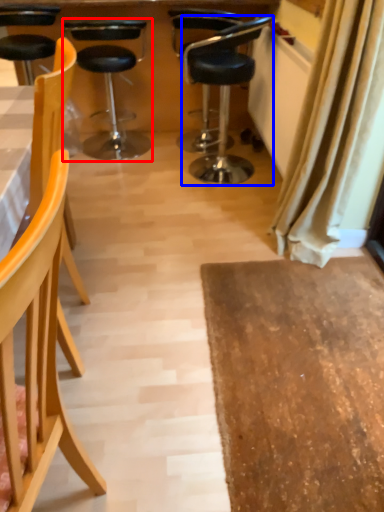
Question: Among these objects, which one is nearest to the camera, chair (highlighted by a red box) or chair (highlighted by a blue box)?

Choices:
 (A) chair
 (B) chair

Answer: (B)